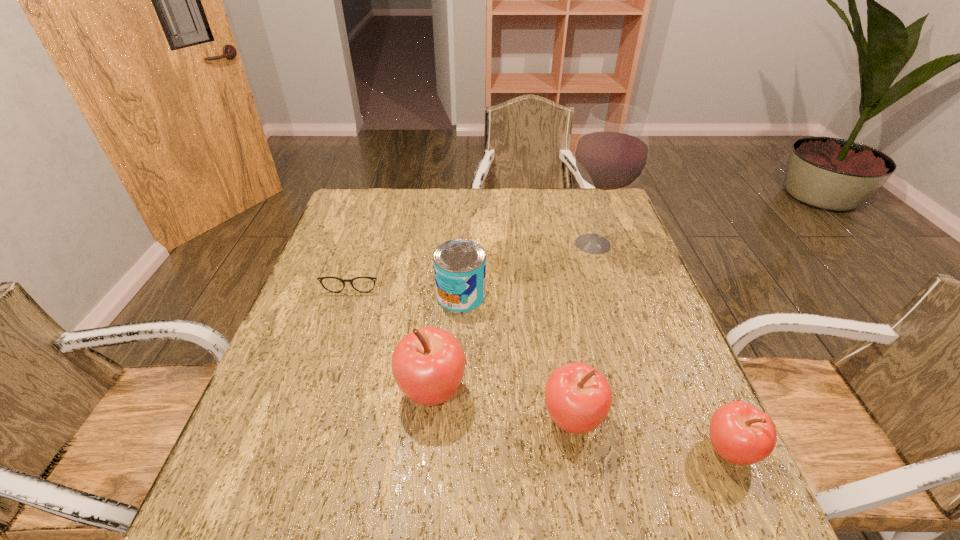
You are a GUI agent. You are given a task and a screenshot of the screen. Output one action in this format:
    pyautogui.click(x=<x>, y=<y>)
    Task: Click on the free space that is in between the tallest object and the can
    This screenshot has height=540, width=960.
    Given the screenshot: What is the action you would take?
    pyautogui.click(x=527, y=269)

Identify the location of free space between the second shortest apple and the shortest object. (465, 346).

You are a GUI agent. You are given a task and a screenshot of the screen. Output one action in this format:
    pyautogui.click(x=<x>, y=<y>)
    Task: Click on the free space between the rightmost apple and the second apple from right to left
    
    Given the screenshot: What is the action you would take?
    pyautogui.click(x=651, y=435)

You are a GUI agent. You are given a task and a screenshot of the screen. Output one action in this format:
    pyautogui.click(x=<x>, y=<y>)
    Task: Click on the unoccupied position between the second apple from right to left and the shortest apple
    The height and width of the screenshot is (540, 960).
    Given the screenshot: What is the action you would take?
    pyautogui.click(x=651, y=435)

At what (x,y) coordinates should I click in order to perform the action: click on object that is the closest to the shortest apple. Please return your answer as a coordinate pair (x, y). The width and height of the screenshot is (960, 540). Looking at the image, I should click on (578, 397).

Locate which object is the second closest to the can. Please provide its 2D coordinates. Your answer should be formatted as a tuple, i.e. [(x, y)], where the tuple contains the x and y coordinates of a point satisfying the conditions above.

[(428, 364)]

You are a GUI agent. You are given a task and a screenshot of the screen. Output one action in this format:
    pyautogui.click(x=<x>, y=<y>)
    Task: Click on the apple that can be found as the closest to the rightmost apple
    
    Given the screenshot: What is the action you would take?
    pyautogui.click(x=578, y=397)

I want to click on apple object that ranks as the closest to the second shortest apple, so click(428, 364).

Identify the location of vacant position in the image that satisfies the following two spatial constraints: 1. through the lenses of the shortest object; 2. on the left side of the can. The height and width of the screenshot is (540, 960). (349, 295).

Locate an element on the screen. The image size is (960, 540). free space that satisfies the following two spatial constraints: 1. through the lenses of the leftmost object; 2. on the right side of the leftmost apple is located at coordinates (318, 391).